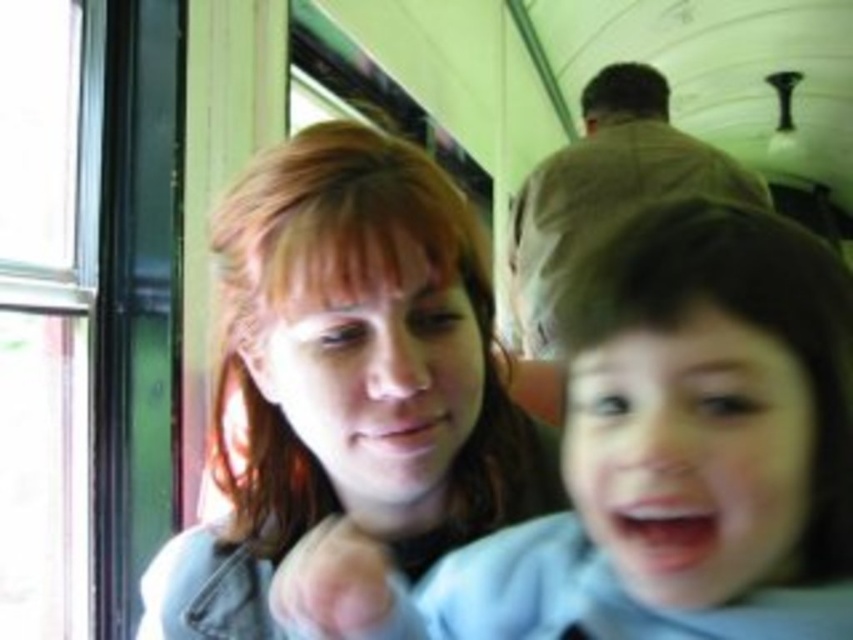
You are a photographer trying to capture a portrait of the smooth skin face at center and the brown fabric coach at upper center in the train carriage. Based on their sizes, which object should you focus on first to ensure both are in frame without cropping?

The smooth skin face at center is not as tall as the brown fabric coach at upper center, so you should focus on the brown fabric coach at upper center first to ensure both fit in the frame without cropping.

You are a photographer trying to capture a portrait of the two people in the train. You notice the smooth skin face at center and the smooth brown hair at center. Which of these two features is positioned closer to the camera?

The smooth skin face at center is closer to the viewer than the smooth brown hair at center, so the smooth skin face at center would be closer to the camera.

You are a passenger on the train and want to know which object is closer to the window located on the left side of the train carriage. Based on the scene, which is closer to the window between the smooth brown hair at center and the brown fabric coach at upper center?

The smooth brown hair at center is closer to the window located on the left side of the train carriage because it is positioned to the left of the brown fabric coach at upper center.